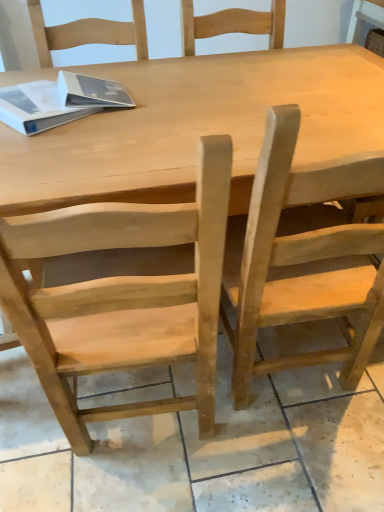
The height and width of the screenshot is (512, 384). What are the coordinates of `natural wood chair at center, the first chair when ordered from left to right` in the screenshot? It's located at (122, 297).

This screenshot has width=384, height=512. What do you see at coordinates (58, 101) in the screenshot?
I see `white matte book at upper left` at bounding box center [58, 101].

Find the location of a particular element. This screenshot has height=512, width=384. natural wood table at center is located at coordinates (208, 131).

This screenshot has width=384, height=512. What do you see at coordinates (298, 272) in the screenshot?
I see `natural wood chair at right, marked as the 2th chair in a left-to-right arrangement` at bounding box center [298, 272].

What are the coordinates of `natural wood chair at center, which ranks as the second chair in right-to-left order` in the screenshot? It's located at (122, 297).

From the image's perspective, would you say natural wood chair at right, which ranks as the 1th chair in right-to-left order, is positioned over natural wood chair at center, the first chair when ordered from left to right?

Yes.

Can you confirm if natural wood chair at right, marked as the 2th chair in a left-to-right arrangement, is taller than natural wood chair at center, which ranks as the second chair in right-to-left order?

In fact, natural wood chair at right, marked as the 2th chair in a left-to-right arrangement, may be shorter than natural wood chair at center, which ranks as the second chair in right-to-left order.

Would you consider natural wood chair at right, marked as the 2th chair in a left-to-right arrangement, to be distant from natural wood chair at center, the first chair when ordered from left to right?

natural wood chair at right, marked as the 2th chair in a left-to-right arrangement, is actually quite close to natural wood chair at center, the first chair when ordered from left to right.

Considering the sizes of objects natural wood table at center and natural wood chair at right, marked as the 2th chair in a left-to-right arrangement, in the image provided, who is thinner, natural wood table at center or natural wood chair at right, marked as the 2th chair in a left-to-right arrangement,?

With smaller width is natural wood chair at right, marked as the 2th chair in a left-to-right arrangement.

Which is more to the right, natural wood table at center or natural wood chair at right, marked as the 2th chair in a left-to-right arrangement?

From the viewer's perspective, natural wood chair at right, marked as the 2th chair in a left-to-right arrangement, appears more on the right side.

Who is shorter, natural wood table at center or natural wood chair at right, marked as the 2th chair in a left-to-right arrangement?

With less height is natural wood table at center.

From the image's perspective, count 1st chairs downward from the natural wood table at center and point to it. Please provide its 2D coordinates.

[(298, 272)]

Based on the photo, from the image's perspective, between natural wood chair at center, the first chair when ordered from left to right, and natural wood chair at right, marked as the 2th chair in a left-to-right arrangement, which one is located above?

natural wood chair at right, marked as the 2th chair in a left-to-right arrangement, is shown above in the image.

Considering the sizes of natural wood chair at center, the first chair when ordered from left to right, and natural wood chair at right, marked as the 2th chair in a left-to-right arrangement, in the image, is natural wood chair at center, the first chair when ordered from left to right, taller or shorter than natural wood chair at right, marked as the 2th chair in a left-to-right arrangement,?

Considering their sizes, natural wood chair at center, the first chair when ordered from left to right, has more height than natural wood chair at right, marked as the 2th chair in a left-to-right arrangement.

Is natural wood chair at center, the first chair when ordered from left to right, positioned far away from natural wood chair at right, which ranks as the 1th chair in right-to-left order?

Actually, natural wood chair at center, the first chair when ordered from left to right, and natural wood chair at right, which ranks as the 1th chair in right-to-left order, are a little close together.

Which object is positioned more to the right, white matte book at upper left or natural wood chair at right, which ranks as the 1th chair in right-to-left order?

natural wood chair at right, which ranks as the 1th chair in right-to-left order, is more to the right.

Is white matte book at upper left not near natural wood chair at right, marked as the 2th chair in a left-to-right arrangement?

Actually, white matte book at upper left and natural wood chair at right, marked as the 2th chair in a left-to-right arrangement, are a little close together.

How many degrees apart are the facing directions of white matte book at upper left and natural wood chair at right, which ranks as the 1th chair in right-to-left order?

A: The angular difference between white matte book at upper left and natural wood chair at right, which ranks as the 1th chair in right-to-left order, is 53.6 degrees.

Can you confirm if white matte book at upper left is taller than natural wood chair at right, which ranks as the 1th chair in right-to-left order?

No, white matte book at upper left is not taller than natural wood chair at right, which ranks as the 1th chair in right-to-left order.

From the image's perspective, between natural wood chair at center, which ranks as the second chair in right-to-left order, and natural wood table at center, which one is located above?

From the image's view, natural wood table at center is above.

Is point (5, 234) in front of point (27, 175)?

Yes.

Considering the sizes of natural wood chair at center, which ranks as the second chair in right-to-left order, and natural wood table at center in the image, is natural wood chair at center, which ranks as the second chair in right-to-left order, bigger or smaller than natural wood table at center?

Considering their sizes, natural wood chair at center, which ranks as the second chair in right-to-left order, takes up less space than natural wood table at center.

Considering the relative sizes of natural wood chair at center, which ranks as the second chair in right-to-left order, and white matte book at upper left in the image provided, is natural wood chair at center, which ranks as the second chair in right-to-left order, thinner than white matte book at upper left?

No.

Which object is further away from the camera, natural wood chair at center, the first chair when ordered from left to right, or white matte book at upper left?

white matte book at upper left is further from the camera.

Considering the relative positions of natural wood chair at center, which ranks as the second chair in right-to-left order, and white matte book at upper left in the image provided, is natural wood chair at center, which ranks as the second chair in right-to-left order, to the right of white matte book at upper left from the viewer's perspective?

Yes, natural wood chair at center, which ranks as the second chair in right-to-left order, is to the right of white matte book at upper left.

This screenshot has width=384, height=512. In order to click on book on the left of natural wood chair at center, the first chair when ordered from left to right in this screenshot , I will do `click(58, 101)`.

Is natural wood chair at right, which ranks as the 1th chair in right-to-left order, at the left side of natural wood table at center?

In fact, natural wood chair at right, which ranks as the 1th chair in right-to-left order, is to the right of natural wood table at center.

Identify the location of the 1st chair in front of the natural wood table at center, starting your count from the anchor. (298, 272).

From the image's perspective, who appears lower, natural wood chair at right, which ranks as the 1th chair in right-to-left order, or natural wood table at center?

natural wood chair at right, which ranks as the 1th chair in right-to-left order, from the image's perspective.

In terms of width, does natural wood chair at right, which ranks as the 1th chair in right-to-left order, look wider or thinner when compared to natural wood table at center?

Considering their sizes, natural wood chair at right, which ranks as the 1th chair in right-to-left order, looks slimmer than natural wood table at center.

You are a GUI agent. You are given a task and a screenshot of the screen. Output one action in this format:
    pyautogui.click(x=<x>, y=<y>)
    Task: Click on the chair located above the natural wood chair at center, the first chair when ordered from left to right (from the image's perspective)
    
    Given the screenshot: What is the action you would take?
    pyautogui.click(x=298, y=272)

Find the location of a particular element. The height and width of the screenshot is (512, 384). chair on the right of the natural wood table at center is located at coordinates tap(298, 272).

Considering their positions, is natural wood chair at right, which ranks as the 1th chair in right-to-left order, positioned further to white matte book at upper left than natural wood chair at center, which ranks as the second chair in right-to-left order?

natural wood chair at right, which ranks as the 1th chair in right-to-left order, is positioned further to the anchor white matte book at upper left.

From the image, which object appears to be farther from natural wood chair at center, which ranks as the second chair in right-to-left order, natural wood table at center or white matte book at upper left?

The object further to natural wood chair at center, which ranks as the second chair in right-to-left order, is white matte book at upper left.

Which object lies nearer to the anchor point natural wood chair at right, which ranks as the 1th chair in right-to-left order, white matte book at upper left or natural wood chair at center, which ranks as the second chair in right-to-left order?

The object closer to natural wood chair at right, which ranks as the 1th chair in right-to-left order, is natural wood chair at center, which ranks as the second chair in right-to-left order.

Estimate the real-world distances between objects in this image. Which object is further from natural wood chair at center, which ranks as the second chair in right-to-left order, natural wood chair at right, marked as the 2th chair in a left-to-right arrangement, or natural wood table at center?

natural wood table at center is further to natural wood chair at center, which ranks as the second chair in right-to-left order.

Which object lies nearer to the anchor point natural wood table at center, natural wood chair at right, marked as the 2th chair in a left-to-right arrangement, or natural wood chair at center, the first chair when ordered from left to right?

natural wood chair at right, marked as the 2th chair in a left-to-right arrangement.

Considering their positions, is natural wood table at center positioned closer to white matte book at upper left than natural wood chair at center, the first chair when ordered from left to right?

natural wood table at center is closer to white matte book at upper left.

In the scene shown: When comparing their distances from white matte book at upper left, does natural wood table at center or natural wood chair at right, marked as the 2th chair in a left-to-right arrangement, seem closer?

The object closer to white matte book at upper left is natural wood table at center.

When comparing their distances from natural wood chair at right, marked as the 2th chair in a left-to-right arrangement, does white matte book at upper left or natural wood table at center seem further?

white matte book at upper left.

The height and width of the screenshot is (512, 384). I want to click on chair between white matte book at upper left and natural wood chair at right, which ranks as the 1th chair in right-to-left order, from left to right, so click(x=122, y=297).

Identify the location of table between natural wood chair at center, the first chair when ordered from left to right, and natural wood chair at right, which ranks as the 1th chair in right-to-left order, from left to right. (208, 131).

I want to click on table between white matte book at upper left and natural wood chair at center, which ranks as the second chair in right-to-left order, vertically, so click(x=208, y=131).

Identify the location of table between white matte book at upper left and natural wood chair at right, which ranks as the 1th chair in right-to-left order, from left to right. The width and height of the screenshot is (384, 512). (208, 131).